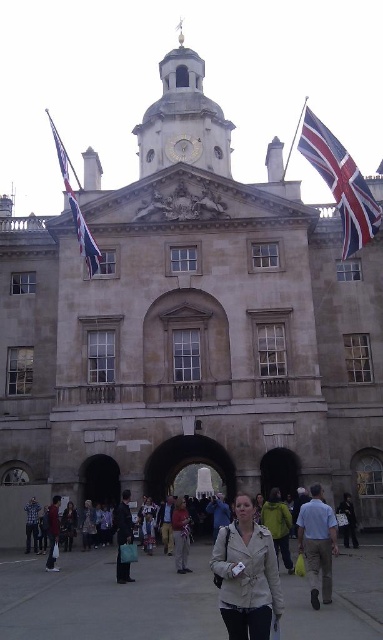
Question: Is light beige leather jacket at center positioned in front of red fabric flag at upper right?

Choices:
 (A) no
 (B) yes

Answer: (B)

Question: Which object appears farthest from the camera in this image?

Choices:
 (A) dark blue jeans at center
 (B) dark brown leather jacket at lower left
 (C) light beige leather jacket at center

Answer: (B)

Question: Is light beige shirt at center wider than denim jacket at lower left?

Choices:
 (A) no
 (B) yes

Answer: (B)

Question: Is red-white striped flag at upper left to the left of light beige jacket at center from the viewer's perspective?

Choices:
 (A) yes
 (B) no

Answer: (A)

Question: Which object is positioned farthest from the denim jacket at lower left?

Choices:
 (A) dark gray fabric jacket at center
 (B) dark blue jeans at center
 (C) red fabric flag at upper right

Answer: (C)

Question: Based on their relative distances, which object is farther from the denim jacket at lower left?

Choices:
 (A) red-white striped flag at upper left
 (B) dark blue jeans at center
 (C) dark gray fabric jacket at center
 (D) light beige leather jacket at center

Answer: (A)